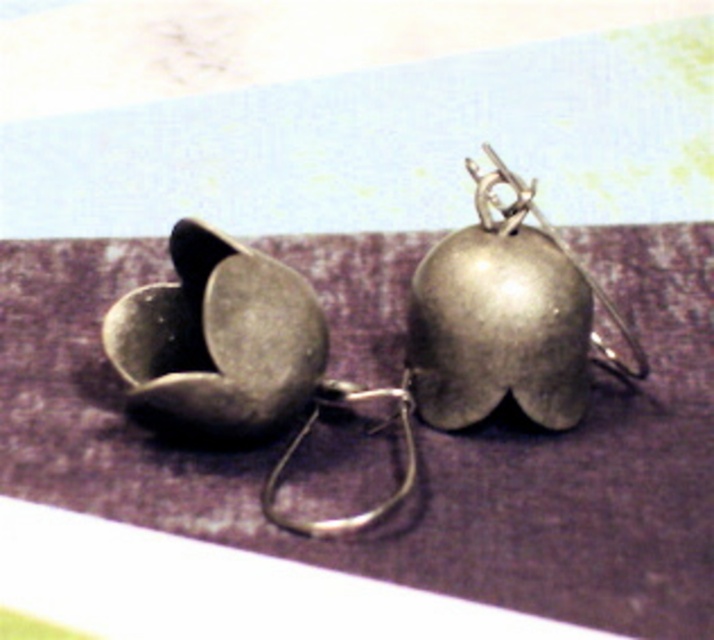
You are an earring designer examining the image. You need to determine which object is taller between the metallic purple mat at center and the polished silver hook at center. Which one is taller?

The metallic purple mat at center is taller than the polished silver hook at center according to the description.